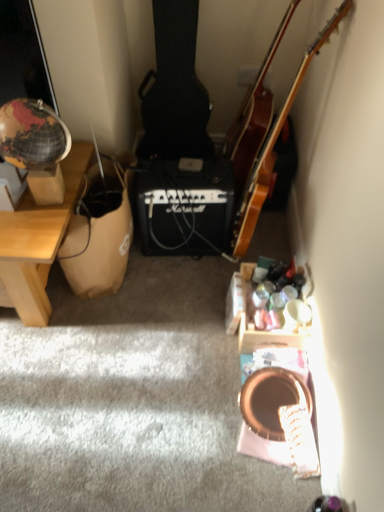
Question: Is wooden acoustic guitar at upper right bigger than wooden acoustic guitar at upper right?

Choices:
 (A) yes
 (B) no

Answer: (A)

Question: Can you confirm if wooden acoustic guitar at upper right is taller than wooden acoustic guitar at upper right?

Choices:
 (A) no
 (B) yes

Answer: (A)

Question: From the image's perspective, is wooden acoustic guitar at upper right below wooden acoustic guitar at upper right?

Choices:
 (A) no
 (B) yes

Answer: (A)

Question: From a real-world perspective, is wooden acoustic guitar at upper right physically above wooden acoustic guitar at upper right?

Choices:
 (A) no
 (B) yes

Answer: (B)

Question: Is wooden acoustic guitar at upper right in contact with wooden acoustic guitar at upper right?

Choices:
 (A) no
 (B) yes

Answer: (B)

Question: Considering the relative positions of wooden acoustic guitar at upper right and wooden acoustic guitar at upper right in the image provided, is wooden acoustic guitar at upper right in front of wooden acoustic guitar at upper right?

Choices:
 (A) no
 (B) yes

Answer: (A)

Question: From a real-world perspective, is wooden acoustic guitar at upper right under brown paper bag at left?

Choices:
 (A) no
 (B) yes

Answer: (A)

Question: Is the depth of wooden acoustic guitar at upper right less than that of brown paper bag at left?

Choices:
 (A) yes
 (B) no

Answer: (A)

Question: Considering the relative sizes of wooden acoustic guitar at upper right and brown paper bag at left in the image provided, is wooden acoustic guitar at upper right thinner than brown paper bag at left?

Choices:
 (A) yes
 (B) no

Answer: (A)

Question: Is wooden acoustic guitar at upper right positioned beyond the bounds of brown paper bag at left?

Choices:
 (A) yes
 (B) no

Answer: (A)

Question: Considering the relative sizes of wooden acoustic guitar at upper right and brown paper bag at left in the image provided, is wooden acoustic guitar at upper right shorter than brown paper bag at left?

Choices:
 (A) yes
 (B) no

Answer: (B)

Question: Is wooden acoustic guitar at upper right bigger than brown paper bag at left?

Choices:
 (A) no
 (B) yes

Answer: (B)

Question: Can you confirm if brown paper bag at left is bigger than wooden acoustic guitar at upper right?

Choices:
 (A) no
 (B) yes

Answer: (A)